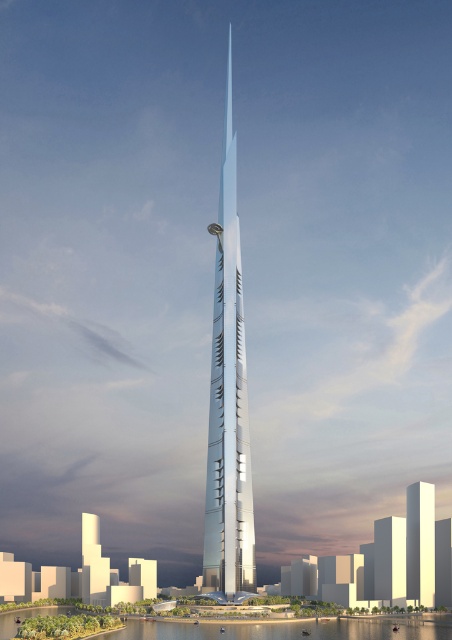
You are standing at the origin point of the coordinate system. The shiny glass skyscraper at center is located at point 0.625, 0.504. If you want to move towards the skyscraper, which direction should you head?

Since the shiny glass skyscraper at center is located at coordinates (x=227, y=400), you should move towards the right and slightly forward to reach it from the origin point.

You are a drone operator trying to capture a photo of the shiny glass skyscraper at center and the shiny silver tower at center. From your current position, which one appears closer to you?

The shiny glass skyscraper at center is positioned over the shiny silver tower at center, so it appears closer to you.

In the scene shown: You are an architect evaluating the proportions of the shiny glass skyscraper at center and the clear water at lower center in the image. Which object has a smaller width?

The shiny glass skyscraper at center is thinner than clear water at lower center, so the skyscraper has a smaller width.